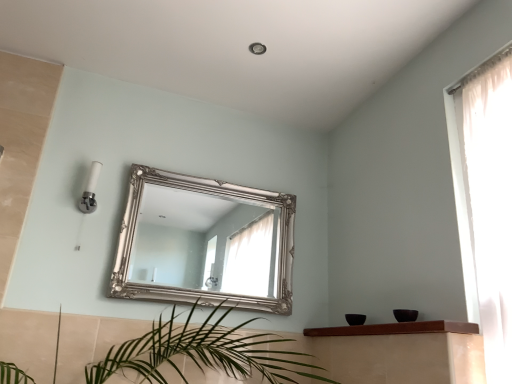
Locate an element on the screen. The height and width of the screenshot is (384, 512). free spot above silver ornate mirror at center (from a real-world perspective) is located at coordinates (217, 182).